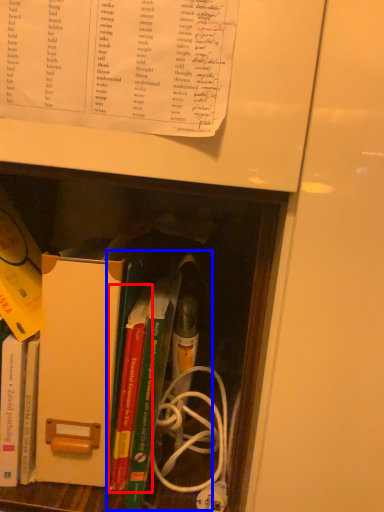
Question: Among these objects, which one is nearest to the camera, book (highlighted by a red box) or book (highlighted by a blue box)?

Choices:
 (A) book
 (B) book

Answer: (B)